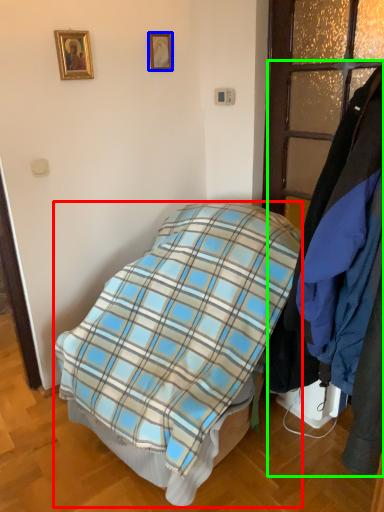
Question: Which object is positioned farthest from bed (highlighted by a red box)? Select from picture frame (highlighted by a blue box) and closet (highlighted by a green box).

Choices:
 (A) picture frame
 (B) closet

Answer: (A)